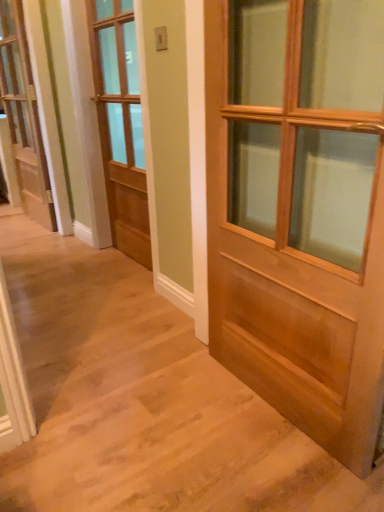
In order to face light brown wooden door at center, marked as the third door in a back-to-front arrangement, should I rotate leftwards or rightwards?

A 11.026 degree turn to the right will do.

The height and width of the screenshot is (512, 384). Find the location of `light brown wooden door at center, marked as the third door in a back-to-front arrangement`. light brown wooden door at center, marked as the third door in a back-to-front arrangement is located at coordinates (299, 211).

The width and height of the screenshot is (384, 512). What are the coordinates of `light brown wood door at center, acting as the 2th door starting from the back` in the screenshot? It's located at (120, 124).

Describe the element at coordinates (120, 124) in the screenshot. I see `light brown wood door at center, acting as the 2th door starting from the right` at that location.

Describe the element at coordinates (24, 116) in the screenshot. This screenshot has width=384, height=512. I see `white painted wood door at left, the 1th door from the left` at that location.

This screenshot has width=384, height=512. I want to click on light brown wooden door at center, placed as the third door when sorted from left to right, so click(299, 211).

Between light brown wood door at center, acting as the 2th door starting from the right, and white painted wood door at left, positioned as the 3th door in right-to-left order, which one has smaller size?

white painted wood door at left, positioned as the 3th door in right-to-left order, is smaller.

From the image's perspective, is light brown wood door at center, the 2th door positioned from the front, beneath white painted wood door at left, marked as the 1th door in a back-to-front arrangement?

Yes.

Considering the points (137, 92) and (16, 10), which point is in front, point (137, 92) or point (16, 10)?

Positioned in front is point (16, 10).

From a real-world perspective, is light brown wood door at center, the 2th door positioned from the front, positioned over white painted wood door at left, placed as the third door when sorted from front to back, based on gravity?

No, from a real-world perspective, light brown wood door at center, the 2th door positioned from the front, is not over white painted wood door at left, placed as the third door when sorted from front to back

From a real-world perspective, is white painted wood door at left, the 1th door from the left, positioned over light brown wooden door at center, marked as the third door in a back-to-front arrangement, based on gravity?

Yes.

Is white painted wood door at left, positioned as the 3th door in right-to-left order, to the right of light brown wooden door at center, the 1th door in the right-to-left sequence, from the viewer's perspective?

No, white painted wood door at left, positioned as the 3th door in right-to-left order, is not to the right of light brown wooden door at center, the 1th door in the right-to-left sequence.

Is white painted wood door at left, placed as the third door when sorted from front to back, positioned far away from light brown wooden door at center, the 1th door in the right-to-left sequence?

white painted wood door at left, placed as the third door when sorted from front to back, is positioned a significant distance from light brown wooden door at center, the 1th door in the right-to-left sequence.

Is light brown wooden door at center, the 1th door in the right-to-left sequence, at the back of white painted wood door at left, the 1th door from the left?

No, light brown wooden door at center, the 1th door in the right-to-left sequence, is not at the back of white painted wood door at left, the 1th door from the left.

Considering the relative positions of light brown wooden door at center, placed as the third door when sorted from left to right, and light brown wood door at center, the 2th door from the left, in the image provided, is light brown wooden door at center, placed as the third door when sorted from left to right, to the left or to the right of light brown wood door at center, the 2th door from the left,?

light brown wooden door at center, placed as the third door when sorted from left to right, is positioned on light brown wood door at center, the 2th door from the left,'s right side.

Does light brown wooden door at center, placed as the first door when sorted from front to back, have a larger size compared to light brown wood door at center, the 2th door positioned from the front?

Indeed, light brown wooden door at center, placed as the first door when sorted from front to back, has a larger size compared to light brown wood door at center, the 2th door positioned from the front.

Are light brown wooden door at center, placed as the third door when sorted from left to right, and light brown wood door at center, acting as the 2th door starting from the back, far apart?

light brown wooden door at center, placed as the third door when sorted from left to right, is positioned a significant distance from light brown wood door at center, acting as the 2th door starting from the back.

Is light brown wooden door at center, placed as the first door when sorted from front to back, in front of or behind light brown wood door at center, acting as the 2th door starting from the right, in the image?

light brown wooden door at center, placed as the first door when sorted from front to back, is in front of light brown wood door at center, acting as the 2th door starting from the right.

Which is more to the right, white painted wood door at left, positioned as the 3th door in right-to-left order, or light brown wood door at center, acting as the 2th door starting from the right?

From the viewer's perspective, light brown wood door at center, acting as the 2th door starting from the right, appears more on the right side.

Considering the points (50, 227) and (132, 215), which point is in front, point (50, 227) or point (132, 215)?

The point (132, 215) is in front.

Is white painted wood door at left, the 1th door from the left, aimed at light brown wood door at center, the 2th door from the left?

No, white painted wood door at left, the 1th door from the left, is not turned towards light brown wood door at center, the 2th door from the left.

Starting from the white painted wood door at left, marked as the 1th door in a back-to-front arrangement, which door is the 1st one to the right? Please provide its 2D coordinates.

[(120, 124)]

Does light brown wood door at center, the 2th door from the left, have a larger size compared to light brown wooden door at center, placed as the first door when sorted from front to back?

Incorrect, light brown wood door at center, the 2th door from the left, is not larger than light brown wooden door at center, placed as the first door when sorted from front to back.

How distant is light brown wood door at center, acting as the 2th door starting from the back, from light brown wooden door at center, placed as the first door when sorted from front to back?

light brown wood door at center, acting as the 2th door starting from the back, and light brown wooden door at center, placed as the first door when sorted from front to back, are 4.25 feet apart.

From the image's perspective, which object appears higher, light brown wood door at center, the 2th door positioned from the front, or light brown wooden door at center, marked as the third door in a back-to-front arrangement?

light brown wood door at center, the 2th door positioned from the front, from the image's perspective.

Is light brown wooden door at center, placed as the first door when sorted from front to back, positioned in front of white painted wood door at left, positioned as the 3th door in right-to-left order?

Yes.

How far apart are light brown wooden door at center, placed as the third door when sorted from left to right, and white painted wood door at left, positioned as the 3th door in right-to-left order?

light brown wooden door at center, placed as the third door when sorted from left to right, is 7.62 feet from white painted wood door at left, positioned as the 3th door in right-to-left order.

Can you confirm if light brown wooden door at center, marked as the third door in a back-to-front arrangement, is shorter than white painted wood door at left, marked as the 1th door in a back-to-front arrangement?

Yes, light brown wooden door at center, marked as the third door in a back-to-front arrangement, is shorter than white painted wood door at left, marked as the 1th door in a back-to-front arrangement.

Can white painted wood door at left, placed as the third door when sorted from front to back, be found inside light brown wooden door at center, placed as the first door when sorted from front to back?

No, white painted wood door at left, placed as the third door when sorted from front to back, is not surrounded by light brown wooden door at center, placed as the first door when sorted from front to back.

At what (x,y) coordinates should I click in order to perform the action: click on door that is the 1st one below the white painted wood door at left, marked as the 1th door in a back-to-front arrangement (from a real-world perspective). Please return your answer as a coordinate pair (x, y). Looking at the image, I should click on click(x=120, y=124).

Identify the location of the 2nd door above the light brown wooden door at center, the 1th door in the right-to-left sequence (from the image's perspective). The height and width of the screenshot is (512, 384). (24, 116).

Which object lies nearer to the anchor point light brown wooden door at center, marked as the third door in a back-to-front arrangement, white painted wood door at left, the 1th door from the left, or light brown wood door at center, the 2th door from the left?

light brown wood door at center, the 2th door from the left.

Estimate the real-world distances between objects in this image. Which object is closer to light brown wooden door at center, placed as the first door when sorted from front to back, light brown wood door at center, the 2th door positioned from the front, or white painted wood door at left, marked as the 1th door in a back-to-front arrangement?

Among the two, light brown wood door at center, the 2th door positioned from the front, is located nearer to light brown wooden door at center, placed as the first door when sorted from front to back.

When comparing their distances from white painted wood door at left, marked as the 1th door in a back-to-front arrangement, does light brown wood door at center, the 2th door positioned from the front, or light brown wooden door at center, marked as the third door in a back-to-front arrangement, seem closer?

The object closer to white painted wood door at left, marked as the 1th door in a back-to-front arrangement, is light brown wood door at center, the 2th door positioned from the front.

Considering their positions, is light brown wooden door at center, the 1th door in the right-to-left sequence, positioned further to light brown wood door at center, the 2th door positioned from the front, than white painted wood door at left, positioned as the 3th door in right-to-left order?

light brown wooden door at center, the 1th door in the right-to-left sequence, lies further to light brown wood door at center, the 2th door positioned from the front, than the other object.

From the image, which object appears to be nearer to light brown wood door at center, acting as the 2th door starting from the right, white painted wood door at left, placed as the third door when sorted from front to back, or light brown wooden door at center, the 1th door in the right-to-left sequence?

white painted wood door at left, placed as the third door when sorted from front to back, is closer to light brown wood door at center, acting as the 2th door starting from the right.

When comparing their distances from white painted wood door at left, the 1th door from the left, does light brown wooden door at center, marked as the third door in a back-to-front arrangement, or light brown wood door at center, the 2th door from the left, seem closer?

Among the two, light brown wood door at center, the 2th door from the left, is located nearer to white painted wood door at left, the 1th door from the left.

Locate an element on the screen. The image size is (384, 512). door located between light brown wooden door at center, placed as the first door when sorted from front to back, and white painted wood door at left, the 1th door from the left, in the depth direction is located at coordinates (120, 124).